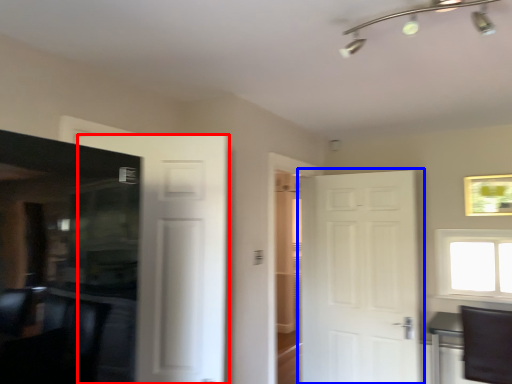
Question: Which point is further to the camera, door (highlighted by a red box) or door (highlighted by a blue box)?

Choices:
 (A) door
 (B) door

Answer: (B)